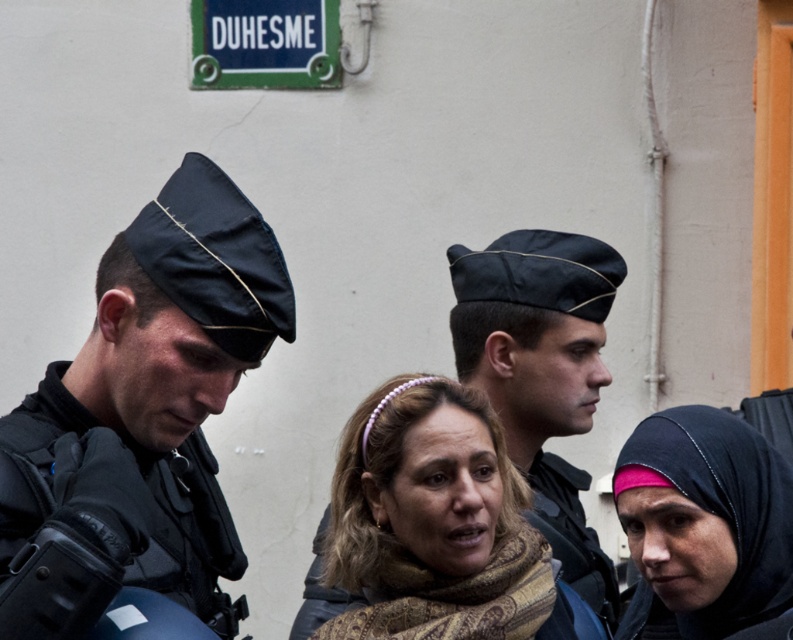
Question: Is pink satin hijab at center below green metal street sign at upper center?

Choices:
 (A) yes
 (B) no

Answer: (A)

Question: Is matte black beret at left below brown textured scarf at center?

Choices:
 (A) yes
 (B) no

Answer: (B)

Question: Which object appears closest to the camera in this image?

Choices:
 (A) green metal street sign at upper center
 (B) matte black beret at center
 (C) black matte uniform at left

Answer: (C)

Question: Is matte black beret at center below pink satin hijab at center?

Choices:
 (A) yes
 (B) no

Answer: (B)

Question: Which object is the farthest from the pink satin hijab at center?

Choices:
 (A) matte black beret at center
 (B) green metal street sign at upper center
 (C) black matte uniform at left

Answer: (B)

Question: Which is farther from the black matte uniform at left?

Choices:
 (A) green metal street sign at upper center
 (B) matte black beret at left

Answer: (A)